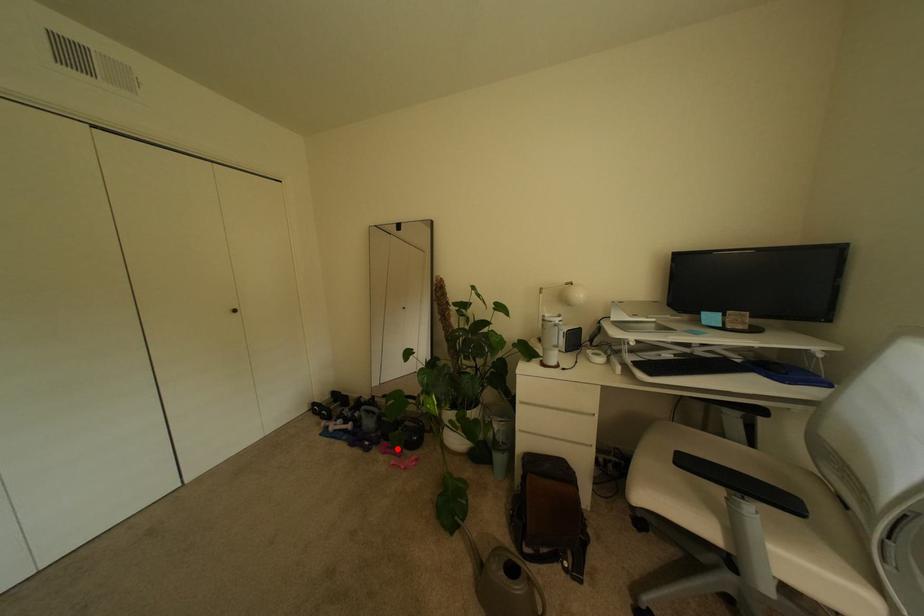
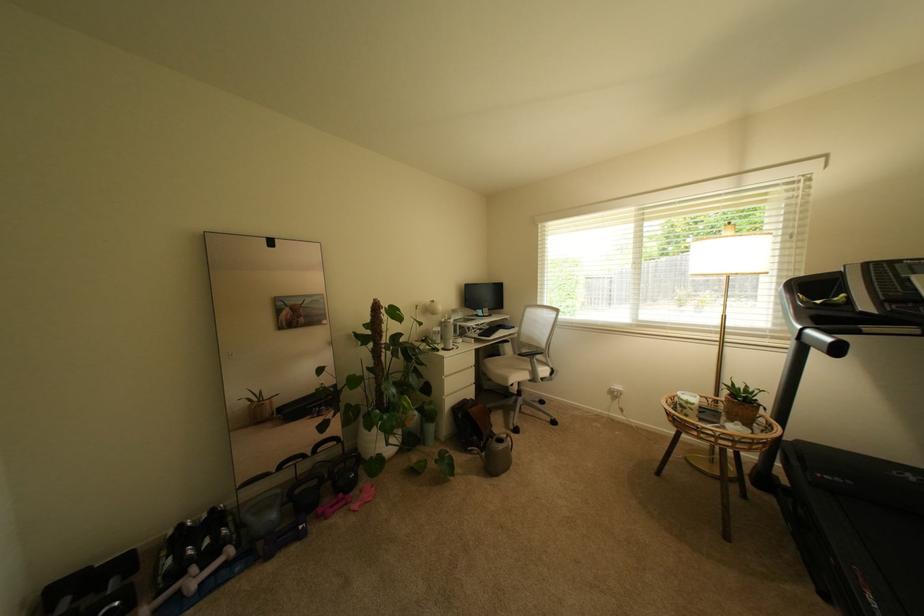
Question: I am providing you with two images of the same scene from different viewpoints. A red point is marked on the first image. Is the red point's position out of view in image 2?

Choices:
 (A) Yes
 (B) No

Answer: (B)